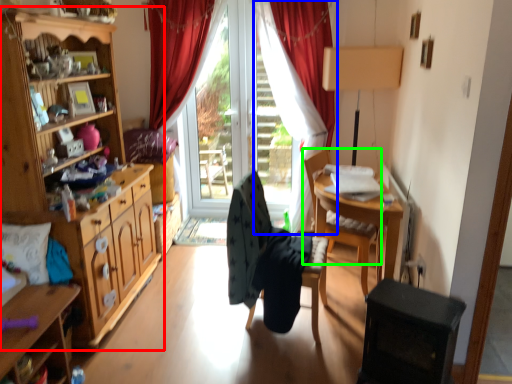
Question: Which is nearer to the cabinetry (highlighted by a red box)? curtain (highlighted by a blue box) or chair (highlighted by a green box).

Choices:
 (A) curtain
 (B) chair

Answer: (B)